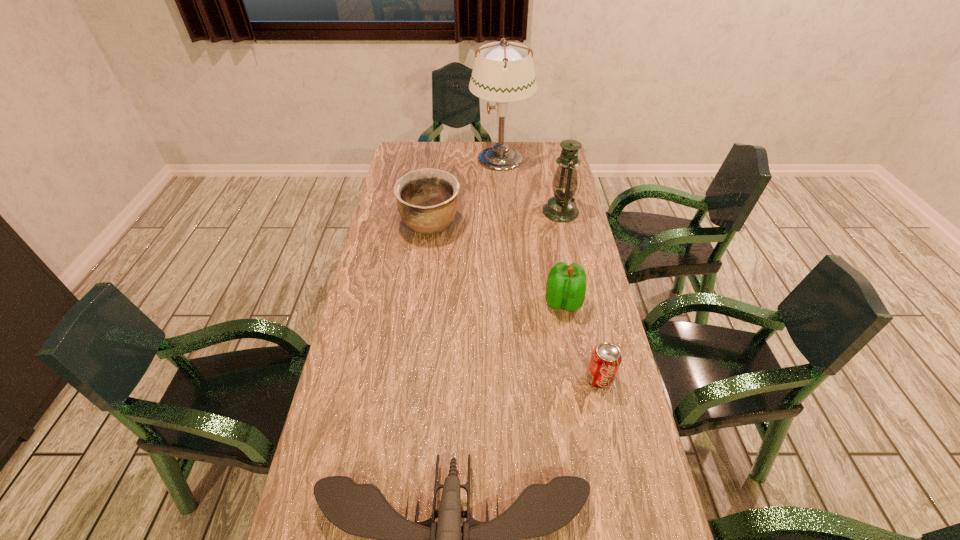
You are a GUI agent. You are given a task and a screenshot of the screen. Output one action in this format:
    pyautogui.click(x=<x>, y=<y>)
    Task: Click on the farthest object
    This screenshot has width=960, height=540.
    Given the screenshot: What is the action you would take?
    pyautogui.click(x=503, y=72)

Where is `lampshade`? lampshade is located at coordinates (503, 72).

This screenshot has width=960, height=540. I want to click on oil lamp, so 561,207.

At what (x,y) coordinates should I click in order to perform the action: click on pottery. Please return your answer as a coordinate pair (x, y). Looking at the image, I should click on (427, 200).

Where is `the third nearest object`? the third nearest object is located at coordinates (566, 284).

This screenshot has width=960, height=540. Find the location of `bell pepper`. bell pepper is located at coordinates (566, 284).

Locate an element on the screen. Image resolution: width=960 pixels, height=540 pixels. soda can is located at coordinates (605, 360).

Identify the location of vacant space located on the lampshade of the lampshade. The height and width of the screenshot is (540, 960). (405, 158).

Identify the location of free spot located 0.280m on the lampshade of the lampshade. This screenshot has width=960, height=540. (405, 158).

Where is `free space located on the lampshade of the lampshade`? The height and width of the screenshot is (540, 960). free space located on the lampshade of the lampshade is located at coordinates (446, 158).